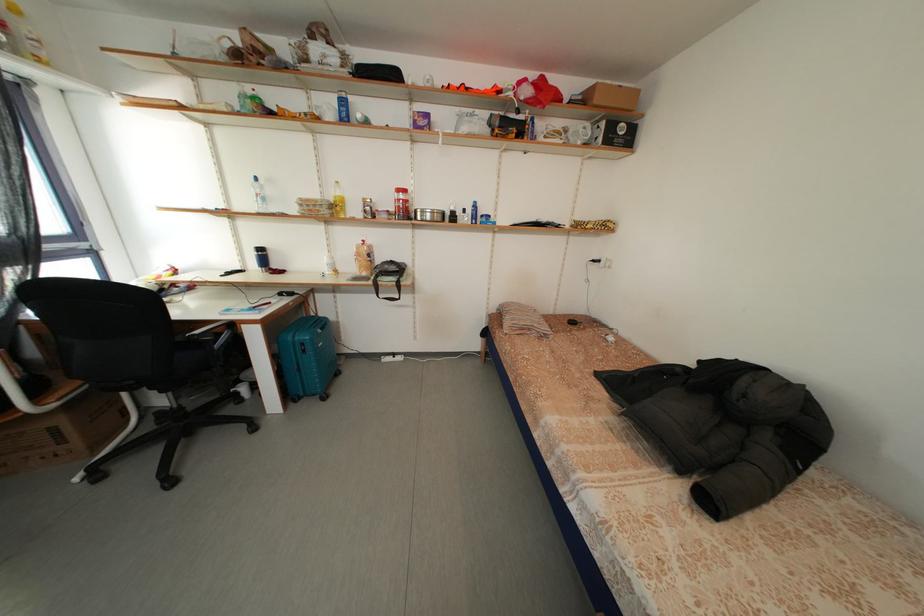
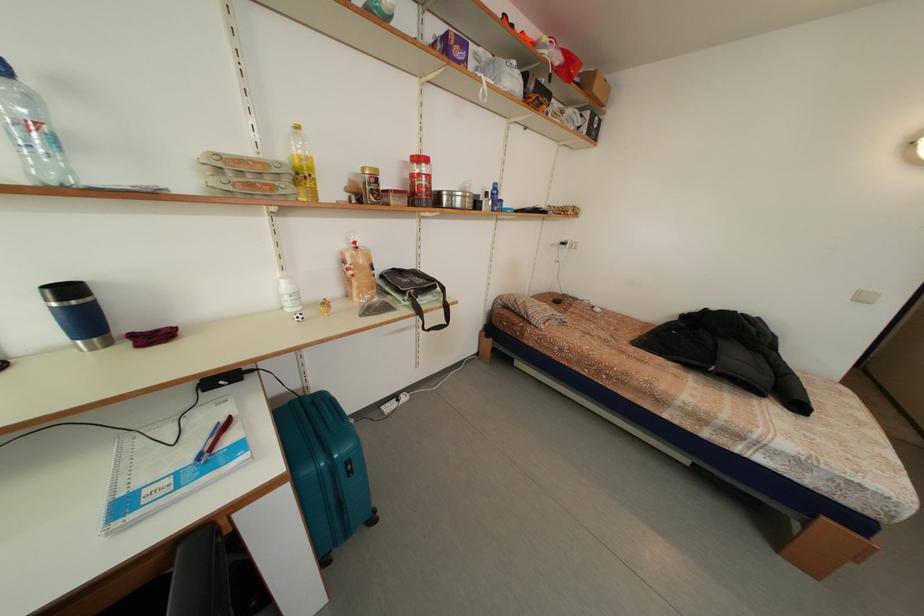
Where in the second image is the point corresponding to point 269,254 from the first image?

(78, 296)